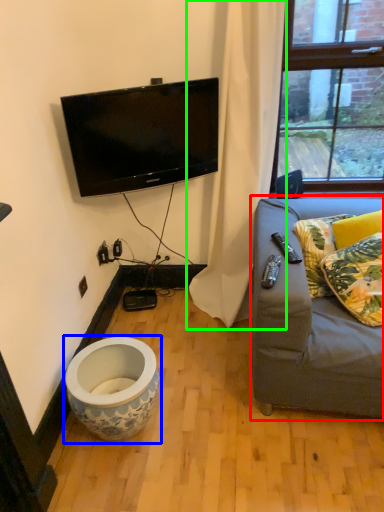
Question: Based on their relative distances, which object is nearer to studio couch (highlighted by a red box)? Choose from toilet (highlighted by a blue box) and curtain (highlighted by a green box).

Choices:
 (A) toilet
 (B) curtain

Answer: (B)